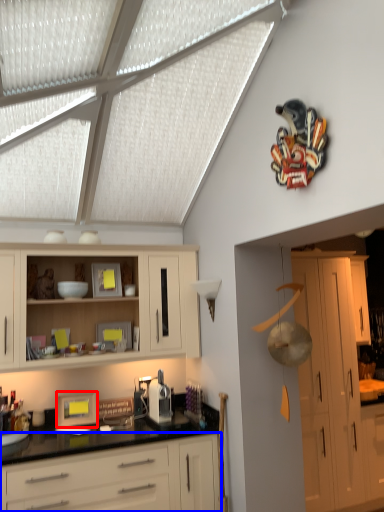
Question: Among these objects, which one is nearest to the camera, picture frame (highlighted by a red box) or cabinetry (highlighted by a blue box)?

Choices:
 (A) picture frame
 (B) cabinetry

Answer: (B)